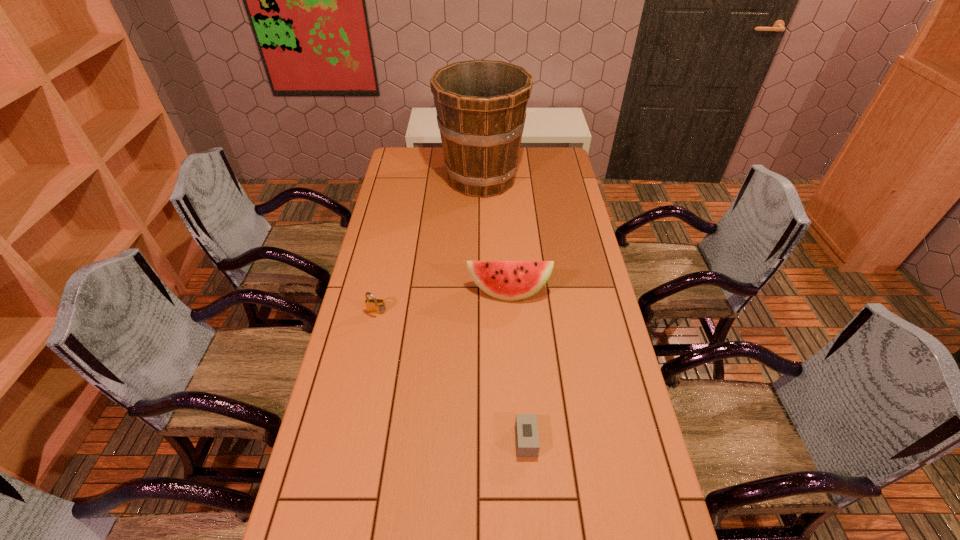
This screenshot has height=540, width=960. I want to click on free spot between the padlock and the bucket, so click(x=429, y=246).

Identify which object is the third closest to the tallest object. Please provide its 2D coordinates. Your answer should be formatted as a tuple, i.e. [(x, y)], where the tuple contains the x and y coordinates of a point satisfying the conditions above.

[(526, 426)]

Image resolution: width=960 pixels, height=540 pixels. I want to click on object that can be found as the second closest to the shortest object, so click(x=375, y=306).